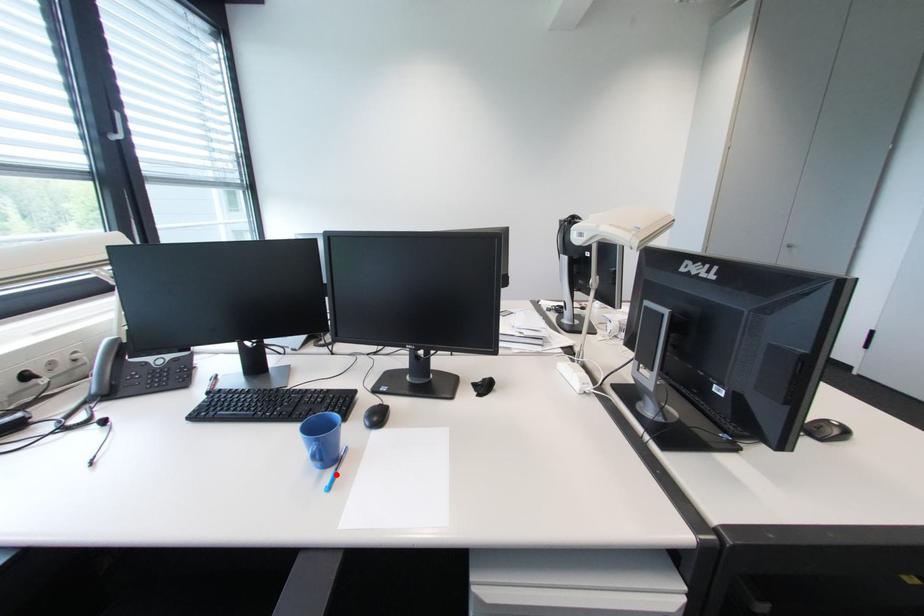
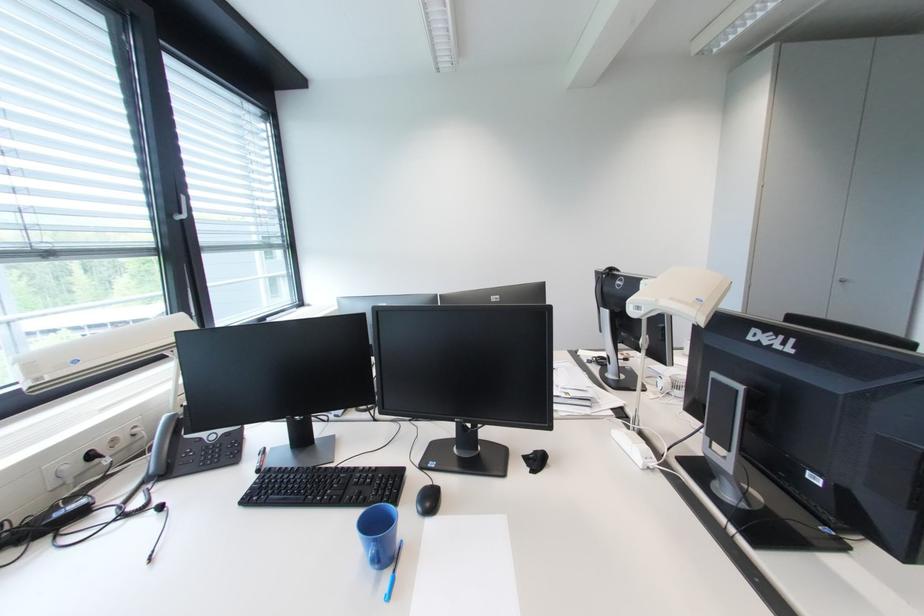
In the second image, find the point that corresponds to the highlighted location in the first image.

(394, 577)